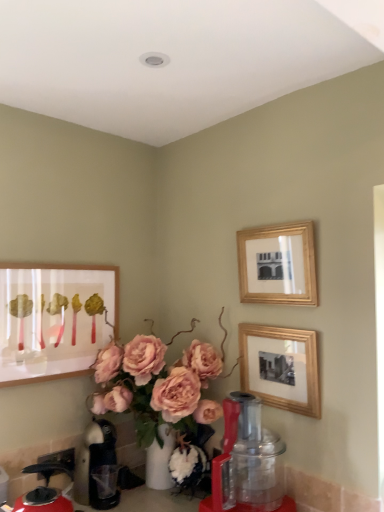
Question: Can you confirm if wooden picture frame at center-right, which is the third picture frame from left to right, is positioned to the right of matte wooden picture frame at left, which ranks as the third picture frame in right-to-left order?

Choices:
 (A) no
 (B) yes

Answer: (B)

Question: From the image's perspective, is wooden picture frame at center-right, which is the third picture frame from left to right, under matte wooden picture frame at left, which ranks as the third picture frame in right-to-left order?

Choices:
 (A) no
 (B) yes

Answer: (B)

Question: Can you confirm if wooden picture frame at center-right, which is the third picture frame from left to right, is bigger than matte wooden picture frame at left, which ranks as the third picture frame in right-to-left order?

Choices:
 (A) yes
 (B) no

Answer: (B)

Question: Is wooden picture frame at center-right, which is the third picture frame from left to right, thinner than matte wooden picture frame at left, which is counted as the first picture frame, starting from the left?

Choices:
 (A) yes
 (B) no

Answer: (B)

Question: From the image's perspective, is wooden picture frame at center-right, which is the 1th picture frame from right to left, on top of matte wooden picture frame at left, which ranks as the third picture frame in right-to-left order?

Choices:
 (A) yes
 (B) no

Answer: (B)

Question: In the image, is wooden picture frame at center-right, which is the 1th picture frame from right to left, on the left side or the right side of gold/glass picture frame at upper right, marked as the second picture frame in a left-to-right arrangement?

Choices:
 (A) left
 (B) right

Answer: (B)

Question: Is wooden picture frame at center-right, which is the third picture frame from left to right, in front of or behind gold/glass picture frame at upper right, which ranks as the second picture frame in right-to-left order, in the image?

Choices:
 (A) front
 (B) behind

Answer: (A)

Question: In terms of width, does wooden picture frame at center-right, which is the 1th picture frame from right to left, look wider or thinner when compared to gold/glass picture frame at upper right, marked as the second picture frame in a left-to-right arrangement?

Choices:
 (A) thin
 (B) wide

Answer: (A)

Question: Considering the positions of wooden picture frame at center-right, which is the 1th picture frame from right to left, and gold/glass picture frame at upper right, marked as the second picture frame in a left-to-right arrangement, in the image, is wooden picture frame at center-right, which is the 1th picture frame from right to left, taller or shorter than gold/glass picture frame at upper right, marked as the second picture frame in a left-to-right arrangement,?

Choices:
 (A) short
 (B) tall

Answer: (A)

Question: Which is correct: red plastic blender at lower center is inside metallic silver coffee pot at lower left, the second coffeepot viewed from the front, or outside of it?

Choices:
 (A) outside
 (B) inside

Answer: (A)

Question: Is red plastic blender at lower center bigger or smaller than metallic silver coffee pot at lower left, the second coffeepot viewed from the front?

Choices:
 (A) small
 (B) big

Answer: (B)

Question: From a real-world perspective, relative to metallic silver coffee pot at lower left, the 1th coffeepot from the back, is red plastic blender at lower center vertically above or below?

Choices:
 (A) above
 (B) below

Answer: (A)

Question: From the image's perspective, is red plastic blender at lower center positioned above or below metallic silver coffee pot at lower left, the 1th coffeepot from the back?

Choices:
 (A) above
 (B) below

Answer: (A)

Question: From the image's perspective, is red plastic blender at lower center positioned above or below pink matte floral arrangement at center?

Choices:
 (A) above
 (B) below

Answer: (B)

Question: Which is correct: red plastic blender at lower center is inside pink matte floral arrangement at center, or outside of it?

Choices:
 (A) inside
 (B) outside

Answer: (A)